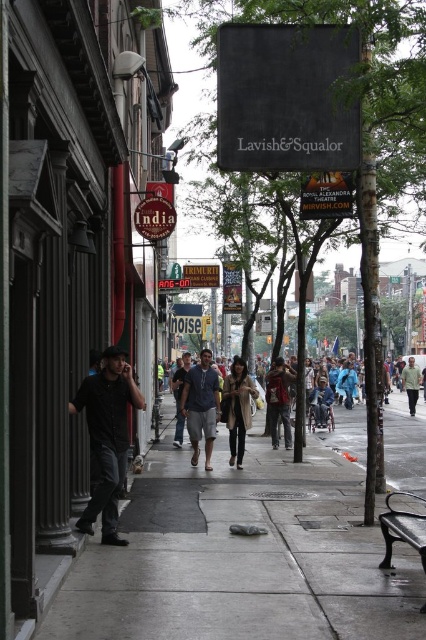
Which is above, black fabric sign at upper center or dark gray jeans at center?

black fabric sign at upper center is higher up.

Which is more to the left, black fabric sign at upper center or dark gray jeans at center?

dark gray jeans at center

Does point (250, 92) come closer to viewer compared to point (181, 438)?

Yes.

This screenshot has width=426, height=640. Find the location of `black fabric sign at upper center`. black fabric sign at upper center is located at coordinates (287, 97).

Is tan leather coat at center to the right of red fabric jacket at center from the viewer's perspective?

Incorrect, tan leather coat at center is not on the right side of red fabric jacket at center.

Where is `tan leather coat at center`? The height and width of the screenshot is (640, 426). tan leather coat at center is located at coordinates (236, 408).

Can you confirm if black matte shirt at left is smaller than red fabric jacket at center?

No, black matte shirt at left is not smaller than red fabric jacket at center.

Which is above, black matte shirt at left or red fabric jacket at center?

black matte shirt at left is above.

At what (x,y) coordinates should I click in order to perform the action: click on black matte shirt at left. Please return your answer as a coordinate pair (x, y). Looking at the image, I should click on (106, 436).

Find the location of a particular element. This screenshot has height=640, width=426. black matte shirt at left is located at coordinates (106, 436).